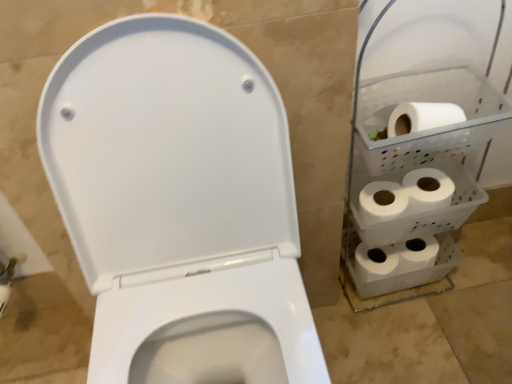
What is the approximate width of white matte toilet paper at right, which is the fourth toilet paper in left-to-right order?

4.44 inches.

What do you see at coordinates (376, 262) in the screenshot? I see `white matte toilet paper at lower right, positioned as the 2th toilet paper in left-to-right order` at bounding box center [376, 262].

Measure the distance between white plastic shelf at right and camera.

They are 27.81 inches apart.

This screenshot has height=384, width=512. What do you see at coordinates (177, 196) in the screenshot? I see `white matte toilet paper at right, which is counted as the fourth toilet paper, starting from the right` at bounding box center [177, 196].

This screenshot has height=384, width=512. I want to click on white matte toilet paper at right, the 1th toilet paper when ordered from left to right, so click(177, 196).

Identify the location of white matte toilet paper at right, which is the first toilet paper in right-to-left order. (406, 195).

Locate an element on the screen. The height and width of the screenshot is (384, 512). the 1st toilet paper behind the white matte toilet paper at right, which ranks as the 3th toilet paper in left-to-right order, counting from the anchor's position is located at coordinates (406, 195).

How different are the orientations of white matte toilet paper at right, which ranks as the 2th toilet paper in right-to-left order, and white matte toilet paper at right, which is the fourth toilet paper in left-to-right order, in degrees?

The facing directions of white matte toilet paper at right, which ranks as the 2th toilet paper in right-to-left order, and white matte toilet paper at right, which is the fourth toilet paper in left-to-right order, are 0.0062 degrees apart.

Consider the image. Which is correct: white matte toilet paper at right, which ranks as the 3th toilet paper in left-to-right order, is inside white matte toilet paper at right, which is the fourth toilet paper in left-to-right order, or outside of it?

white matte toilet paper at right, which ranks as the 3th toilet paper in left-to-right order, is located beyond the bounds of white matte toilet paper at right, which is the fourth toilet paper in left-to-right order.

From a real-world perspective, is white matte toilet paper at right, which ranks as the 3th toilet paper in left-to-right order, under white matte toilet paper at right, which is the first toilet paper in right-to-left order?

Actually, white matte toilet paper at right, which ranks as the 3th toilet paper in left-to-right order, is physically above white matte toilet paper at right, which is the first toilet paper in right-to-left order, in the real world.

Consider the image. Is white plastic shelf at right not within white matte toilet paper at right, which is counted as the fourth toilet paper, starting from the right?

Yes.

Considering the relative sizes of white plastic shelf at right and white matte toilet paper at right, which is counted as the fourth toilet paper, starting from the right, in the image provided, is white plastic shelf at right wider than white matte toilet paper at right, which is counted as the fourth toilet paper, starting from the right,?

No, white plastic shelf at right is not wider than white matte toilet paper at right, which is counted as the fourth toilet paper, starting from the right.

Who is taller, white plastic shelf at right or white matte toilet paper at right, the 1th toilet paper when ordered from left to right?

white matte toilet paper at right, the 1th toilet paper when ordered from left to right.

From a real-world perspective, is white plastic shelf at right above or below white matte toilet paper at right, the 1th toilet paper when ordered from left to right?

Clearly, from a real-world perspective, white plastic shelf at right is below white matte toilet paper at right, the 1th toilet paper when ordered from left to right.

Based on their sizes in the image, would you say white matte toilet paper at right, which is the first toilet paper in right-to-left order, is bigger or smaller than white matte toilet paper at right, which ranks as the 3th toilet paper in left-to-right order?

Considering their sizes, white matte toilet paper at right, which is the first toilet paper in right-to-left order, takes up more space than white matte toilet paper at right, which ranks as the 3th toilet paper in left-to-right order.

Consider the image. From the image's perspective, would you say white matte toilet paper at right, which is the fourth toilet paper in left-to-right order, is shown under white matte toilet paper at right, which ranks as the 3th toilet paper in left-to-right order?

Yes, from the image's perspective, white matte toilet paper at right, which is the fourth toilet paper in left-to-right order, is below white matte toilet paper at right, which ranks as the 3th toilet paper in left-to-right order.

Is white matte toilet paper at right, which is the first toilet paper in right-to-left order, taller than white matte toilet paper at right, which ranks as the 3th toilet paper in left-to-right order?

Indeed, white matte toilet paper at right, which is the first toilet paper in right-to-left order, has a greater height compared to white matte toilet paper at right, which ranks as the 3th toilet paper in left-to-right order.

From a real-world perspective, between white matte toilet paper at right, which is the fourth toilet paper in left-to-right order, and white matte toilet paper at right, which ranks as the 2th toilet paper in right-to-left order, who is vertically lower?

In real-world perspective, white matte toilet paper at right, which is the fourth toilet paper in left-to-right order, is lower.

Could you measure the distance between white plastic shelf at right and white matte toilet paper at right, which ranks as the 2th toilet paper in right-to-left order?

white plastic shelf at right is 7.95 inches from white matte toilet paper at right, which ranks as the 2th toilet paper in right-to-left order.

Which object is closer to the camera, white plastic shelf at right or white matte toilet paper at right, which ranks as the 2th toilet paper in right-to-left order?

white plastic shelf at right.

Would you say white matte toilet paper at right, which ranks as the 2th toilet paper in right-to-left order, is part of white plastic shelf at right's contents?

Yes, white matte toilet paper at right, which ranks as the 2th toilet paper in right-to-left order, is surrounded by white plastic shelf at right.

Which is in front, point (370, 239) or point (407, 124)?

The point (407, 124) is closer to the camera.

Find the location of `toilet paper that is the 3rd object located above the white matte toilet paper at right, the 1th toilet paper when ordered from left to right (from the image's perspective)`. toilet paper that is the 3rd object located above the white matte toilet paper at right, the 1th toilet paper when ordered from left to right (from the image's perspective) is located at coordinates (422, 117).

Does white matte toilet paper at right, which ranks as the 2th toilet paper in right-to-left order, turn towards white matte toilet paper at right, which is counted as the fourth toilet paper, starting from the right?

No, white matte toilet paper at right, which ranks as the 2th toilet paper in right-to-left order, is not turned towards white matte toilet paper at right, which is counted as the fourth toilet paper, starting from the right.

From a real-world perspective, between white matte toilet paper at right, which ranks as the 2th toilet paper in right-to-left order, and white matte toilet paper at right, the 1th toilet paper when ordered from left to right, who is vertically lower?

In real-world perspective, white matte toilet paper at right, the 1th toilet paper when ordered from left to right, is lower.

Which object is closer to the camera taking this photo, white matte toilet paper at right, which ranks as the 3th toilet paper in left-to-right order, or white matte toilet paper at right, which is counted as the fourth toilet paper, starting from the right?

white matte toilet paper at right, which is counted as the fourth toilet paper, starting from the right, is in front.

How many degrees apart are the facing directions of white matte toilet paper at lower right, positioned as the 2th toilet paper in left-to-right order, and white matte toilet paper at right, which is counted as the fourth toilet paper, starting from the right?

There is a 1.23-degree angle between the facing directions of white matte toilet paper at lower right, positioned as the 2th toilet paper in left-to-right order, and white matte toilet paper at right, which is counted as the fourth toilet paper, starting from the right.

Could you tell me if white matte toilet paper at lower right, which is the 3th toilet paper from right to left, is facing white matte toilet paper at right, which is counted as the fourth toilet paper, starting from the right?

No, white matte toilet paper at lower right, which is the 3th toilet paper from right to left, does not turn towards white matte toilet paper at right, which is counted as the fourth toilet paper, starting from the right.

From a real-world perspective, is white matte toilet paper at lower right, positioned as the 2th toilet paper in left-to-right order, on top of white matte toilet paper at right, the 1th toilet paper when ordered from left to right?

Actually, white matte toilet paper at lower right, positioned as the 2th toilet paper in left-to-right order, is physically below white matte toilet paper at right, the 1th toilet paper when ordered from left to right, in the real world.

Is white matte toilet paper at right, which is the fourth toilet paper in left-to-right order, taller or shorter than white plastic shelf at right?

Considering their sizes, white matte toilet paper at right, which is the fourth toilet paper in left-to-right order, has less height than white plastic shelf at right.

Considering the positions of point (441, 200) and point (495, 92), is point (441, 200) closer or farther from the camera than point (495, 92)?

Clearly, point (441, 200) is more distant from the camera than point (495, 92).

Is white matte toilet paper at right, which is the fourth toilet paper in left-to-right order, not inside white plastic shelf at right?

No, most part of white matte toilet paper at right, which is the fourth toilet paper in left-to-right order, lies within white plastic shelf at right.

Does white matte toilet paper at right, which is the first toilet paper in right-to-left order, have a larger size compared to white plastic shelf at right?

No, white matte toilet paper at right, which is the first toilet paper in right-to-left order, is not bigger than white plastic shelf at right.

Locate an element on the screen. the 1st toilet paper below when counting from the white matte toilet paper at right, which ranks as the 3th toilet paper in left-to-right order (from the image's perspective) is located at coordinates (406, 195).

Starting from the white plastic shelf at right, which toilet paper is the 3rd one to the left? Please provide its 2D coordinates.

[(177, 196)]

Estimate the real-world distances between objects in this image. Which object is further from white matte toilet paper at right, which ranks as the 2th toilet paper in right-to-left order, white matte toilet paper at lower right, which is the 3th toilet paper from right to left, or white plastic shelf at right?

white matte toilet paper at lower right, which is the 3th toilet paper from right to left.

Estimate the real-world distances between objects in this image. Which object is closer to white matte toilet paper at lower right, positioned as the 2th toilet paper in left-to-right order, white matte toilet paper at right, which ranks as the 2th toilet paper in right-to-left order, or white plastic shelf at right?

white plastic shelf at right.

Considering their positions, is white matte toilet paper at right, which is the first toilet paper in right-to-left order, positioned further to white plastic shelf at right than white matte toilet paper at lower right, which is the 3th toilet paper from right to left?

white matte toilet paper at lower right, which is the 3th toilet paper from right to left, is positioned further to the anchor white plastic shelf at right.

Which object lies nearer to the anchor point white matte toilet paper at right, which is the first toilet paper in right-to-left order, white matte toilet paper at right, the 1th toilet paper when ordered from left to right, or white plastic shelf at right?

Based on the image, white plastic shelf at right appears to be nearer to white matte toilet paper at right, which is the first toilet paper in right-to-left order.

When comparing their distances from white plastic shelf at right, does white matte toilet paper at right, which ranks as the 2th toilet paper in right-to-left order, or white matte toilet paper at right, which is the first toilet paper in right-to-left order, seem closer?

Among the two, white matte toilet paper at right, which is the first toilet paper in right-to-left order, is located nearer to white plastic shelf at right.

Which object lies nearer to the anchor point white matte toilet paper at right, which is the fourth toilet paper in left-to-right order, white matte toilet paper at lower right, which is the 3th toilet paper from right to left, or white matte toilet paper at right, the 1th toilet paper when ordered from left to right?

white matte toilet paper at lower right, which is the 3th toilet paper from right to left, is positioned closer to the anchor white matte toilet paper at right, which is the fourth toilet paper in left-to-right order.

Considering their positions, is white matte toilet paper at right, which ranks as the 2th toilet paper in right-to-left order, positioned further to white matte toilet paper at right, which is the fourth toilet paper in left-to-right order, than white matte toilet paper at lower right, which is the 3th toilet paper from right to left?

white matte toilet paper at right, which ranks as the 2th toilet paper in right-to-left order, is further to white matte toilet paper at right, which is the fourth toilet paper in left-to-right order.

Looking at this image, looking at the image, which one is located further to white matte toilet paper at right, which is the first toilet paper in right-to-left order, white matte toilet paper at lower right, positioned as the 2th toilet paper in left-to-right order, or white plastic shelf at right?

white matte toilet paper at lower right, positioned as the 2th toilet paper in left-to-right order.

You are a GUI agent. You are given a task and a screenshot of the screen. Output one action in this format:
    pyautogui.click(x=<x>, y=<y>)
    Task: Click on the toilet paper between white plastic shelf at right and white matte toilet paper at right, which is the fourth toilet paper in left-to-right order, in the front-back direction
    The height and width of the screenshot is (384, 512).
    Given the screenshot: What is the action you would take?
    pyautogui.click(x=422, y=117)

Locate an element on the screen. The image size is (512, 384). toilet paper between white matte toilet paper at right, the 1th toilet paper when ordered from left to right, and white matte toilet paper at right, which is the fourth toilet paper in left-to-right order, in the front-back direction is located at coordinates (422, 117).

This screenshot has width=512, height=384. What are the coordinates of `toilet paper between white matte toilet paper at right, which ranks as the 3th toilet paper in left-to-right order, and white matte toilet paper at lower right, which is the 3th toilet paper from right to left, in the front-back direction` in the screenshot? It's located at (406, 195).

This screenshot has height=384, width=512. Identify the location of shelf positioned between white matte toilet paper at right, which is counted as the fourth toilet paper, starting from the right, and white matte toilet paper at right, which is the fourth toilet paper in left-to-right order, from near to far. (418, 164).